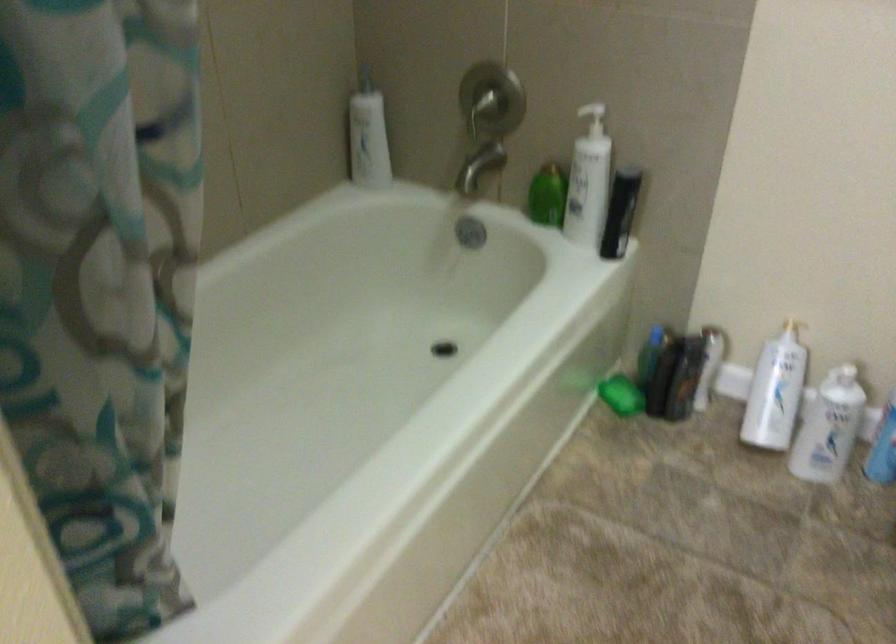
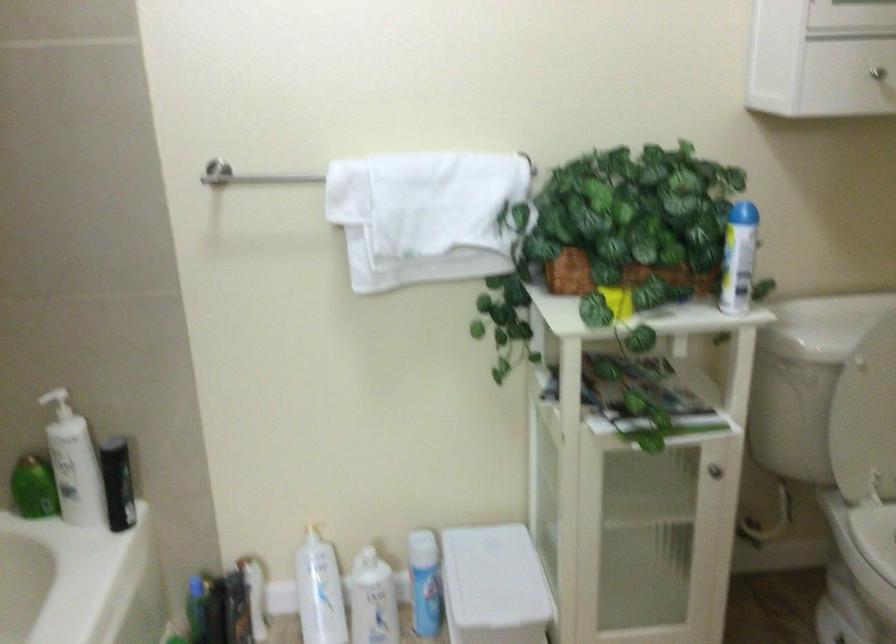
Locate, in the second image, the point that corresponds to [773,389] in the first image.

(319, 591)